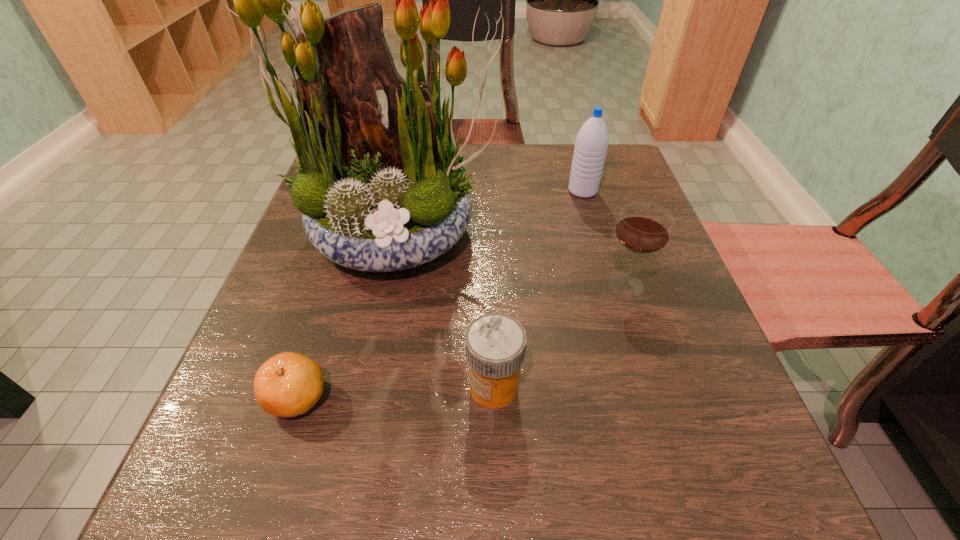
What are the coordinates of `vacant region between the tallest object and the wineglass` in the screenshot? It's located at (512, 259).

At what (x,y) coordinates should I click in order to perform the action: click on free space between the water bottle and the tallest object. Please return your answer as a coordinate pair (x, y). Looking at the image, I should click on (491, 213).

The width and height of the screenshot is (960, 540). Identify the location of free space between the third tallest object and the flower arrangement. (512, 259).

Find the location of `vacant area that lies between the shortest object and the medicine`. vacant area that lies between the shortest object and the medicine is located at coordinates (396, 392).

Locate an element on the screen. This screenshot has width=960, height=540. free space between the water bottle and the shortest object is located at coordinates (440, 294).

You are a GUI agent. You are given a task and a screenshot of the screen. Output one action in this format:
    pyautogui.click(x=<x>, y=<y>)
    Task: Click on the empty location between the wineglass and the water bottle
    This screenshot has width=960, height=540.
    Given the screenshot: What is the action you would take?
    pyautogui.click(x=604, y=238)

What are the coordinates of `object that stands as the third closest to the second shortest object` in the screenshot? It's located at (644, 228).

Select which object appears as the second closest to the clementine. Please provide its 2D coordinates. Your answer should be formatted as a tuple, i.e. [(x, y)], where the tuple contains the x and y coordinates of a point satisfying the conditions above.

[(495, 343)]

Identify the location of free space that satisfies the following two spatial constraints: 1. on the back side of the second tallest object; 2. on the left side of the clementine. (364, 191).

Find the location of `free spot that satisfies the following two spatial constraints: 1. on the front side of the third tallest object; 2. on the right side of the water bottle`. free spot that satisfies the following two spatial constraints: 1. on the front side of the third tallest object; 2. on the right side of the water bottle is located at coordinates (610, 285).